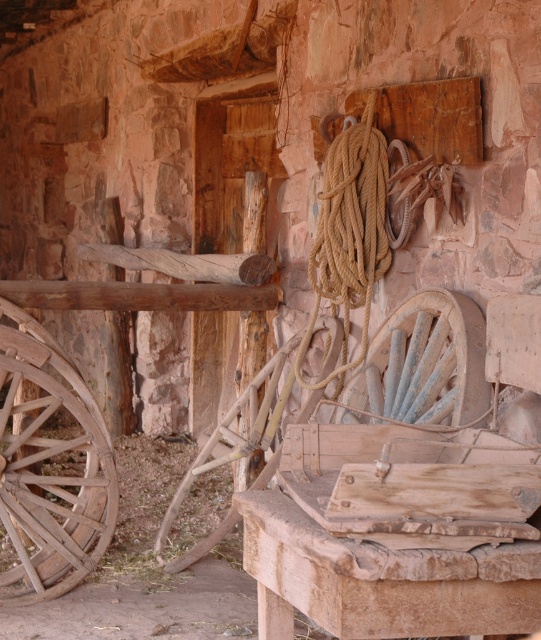
Who is positioned more to the left, weathered wood wagon wheel at left or rusty metal wagon wheel at center?

weathered wood wagon wheel at left is more to the left.

Who is more distant from viewer, (x=58, y=557) or (x=471, y=413)?

Point (x=58, y=557)

Who is more forward, [60,396] or [359,406]?

Point [359,406]

I want to click on weathered wood wagon wheel at left, so click(49, 467).